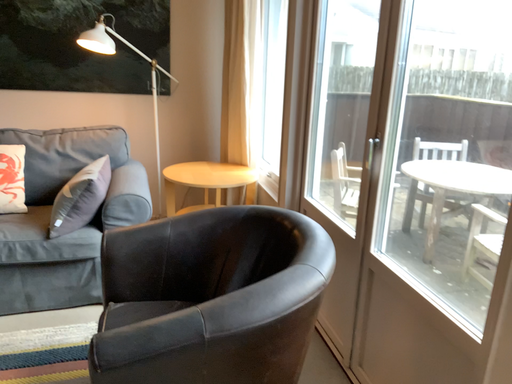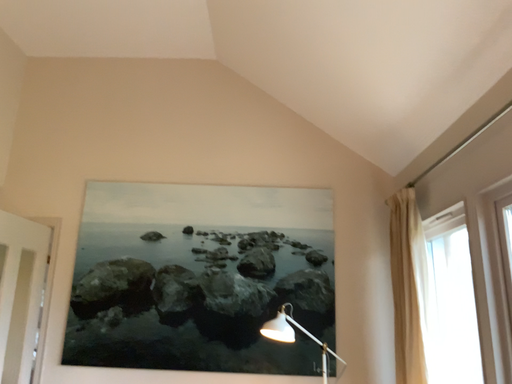
Question: How did the camera likely rotate when shooting the video?

Choices:
 (A) rotated right
 (B) rotated left

Answer: (B)